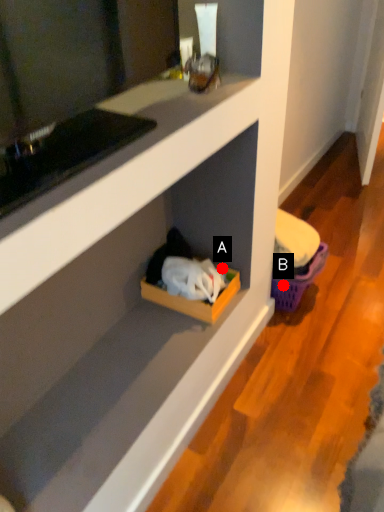
Question: Two points are circled on the image, labeled by A and B beside each circle. Which point is further to the camera?

Choices:
 (A) A is further
 (B) B is further

Answer: (B)